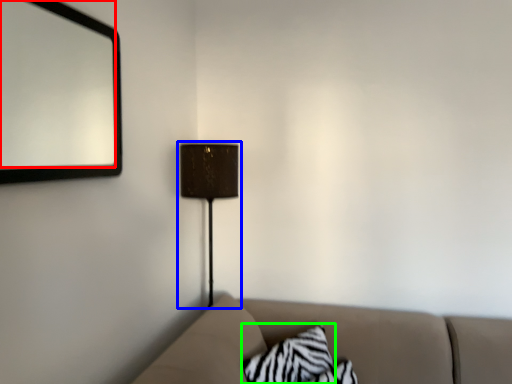
Question: Which object is the closest to the mirror (highlighted by a red box)? Choose among these: lamp (highlighted by a blue box) or pillow (highlighted by a green box).

Choices:
 (A) lamp
 (B) pillow

Answer: (A)